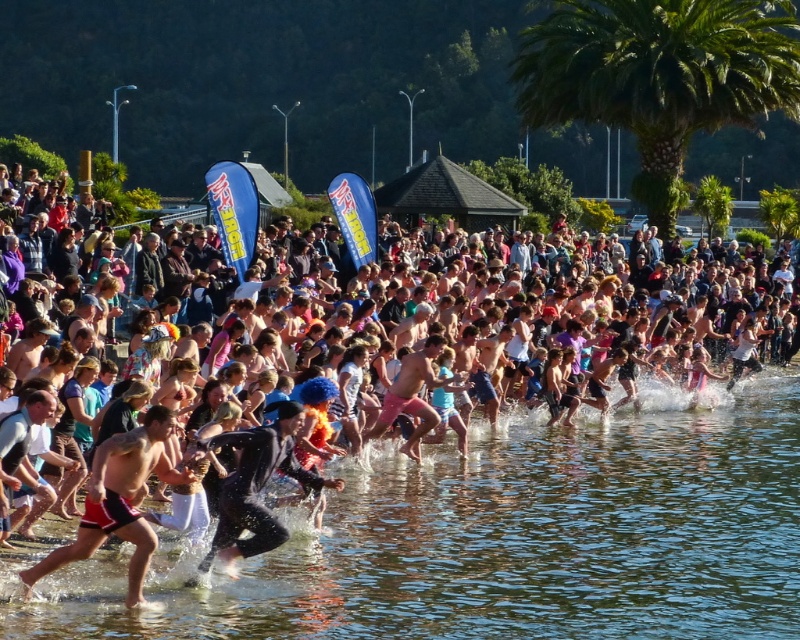
Question: Which point is farther to the camera?

Choices:
 (A) (290, 540)
 (B) (586, 61)
 (C) (124, 472)

Answer: (B)

Question: Does clear water at center have a lesser width compared to red shorts at center?

Choices:
 (A) yes
 (B) no

Answer: (B)

Question: Is pink fabric crowd at center smaller than red shorts at center?

Choices:
 (A) no
 (B) yes

Answer: (A)

Question: Can you confirm if pink fabric crowd at center is wider than green leafy palm tree at upper right?

Choices:
 (A) yes
 (B) no

Answer: (A)

Question: Which point is farther to the camera?

Choices:
 (A) (404, 336)
 (B) (320, 561)
 (C) (604, 108)
 (D) (73, 554)

Answer: (C)

Question: Which point is closer to the camera taking this photo?

Choices:
 (A) (748, 88)
 (B) (154, 458)

Answer: (B)